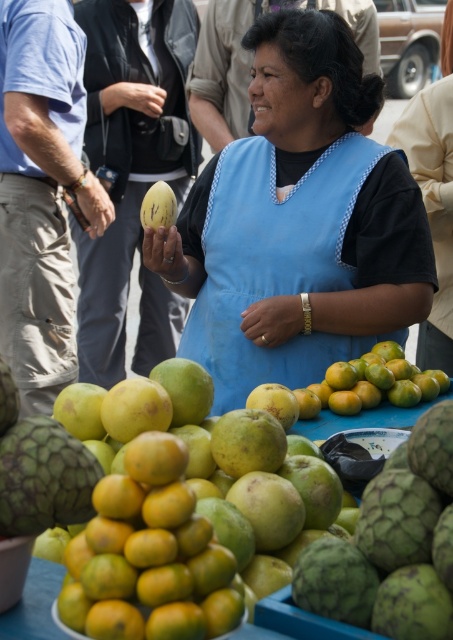
You are a customer at the market and want to buy both the smooth green fruit at center and the smooth orange tangerine at lower left. Which fruit is located to the right of the other?

The smooth green fruit at center is positioned on the right side of the smooth orange tangerine at lower left.

You are a customer at the market and want to buy the fruit that is bigger between the smooth orange tangerine at lower left and the green matte melon at center. Which one should you choose?

The smooth orange tangerine at lower left is larger in size than the green matte melon at center, so you should choose the smooth orange tangerine at lower left.

Looking at the table in the market scene, which fruit is taller between the smooth orange tangerine at lower left and the green matte melon at center?

The smooth orange tangerine at lower left is much taller than the green matte melon at center.